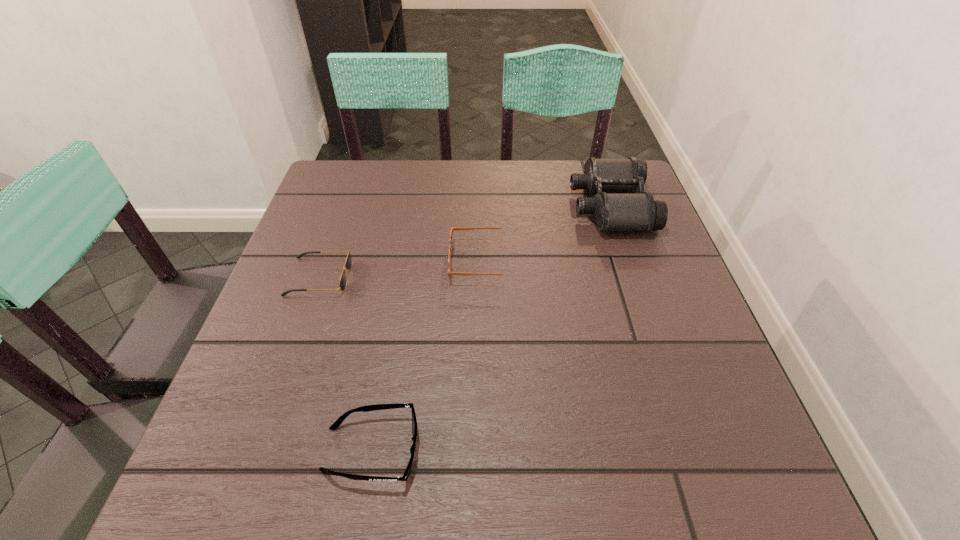
Where is `sunglasses that is the second closest to the second sunglasses from left to right`? sunglasses that is the second closest to the second sunglasses from left to right is located at coordinates (452, 228).